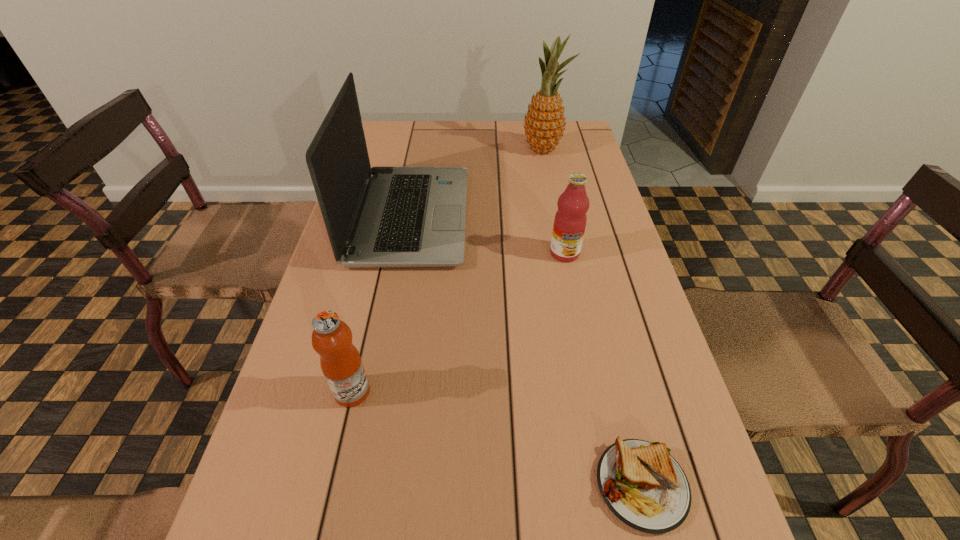
Locate an element on the screen. This screenshot has height=540, width=960. pineapple is located at coordinates (544, 123).

Identify the location of laptop computer. The height and width of the screenshot is (540, 960). (381, 216).

At what (x,y) coordinates should I click in order to perform the action: click on the right fruit juice. Please return your answer as a coordinate pair (x, y). The width and height of the screenshot is (960, 540). Looking at the image, I should click on (570, 219).

The height and width of the screenshot is (540, 960). In order to click on the left fruit juice in this screenshot , I will do `click(340, 361)`.

Image resolution: width=960 pixels, height=540 pixels. I want to click on the nearer fruit juice, so click(340, 361).

Where is `the nearest object`? This screenshot has width=960, height=540. the nearest object is located at coordinates (642, 484).

Locate an element on the screen. the shortest object is located at coordinates (642, 484).

Image resolution: width=960 pixels, height=540 pixels. I want to click on free location located on the left of the farthest object, so click(500, 150).

What are the coordinates of `vacant space located on the screen of the laptop computer` in the screenshot? It's located at point(502,217).

The image size is (960, 540). I want to click on free space located on the label of the farther fruit juice, so click(578, 320).